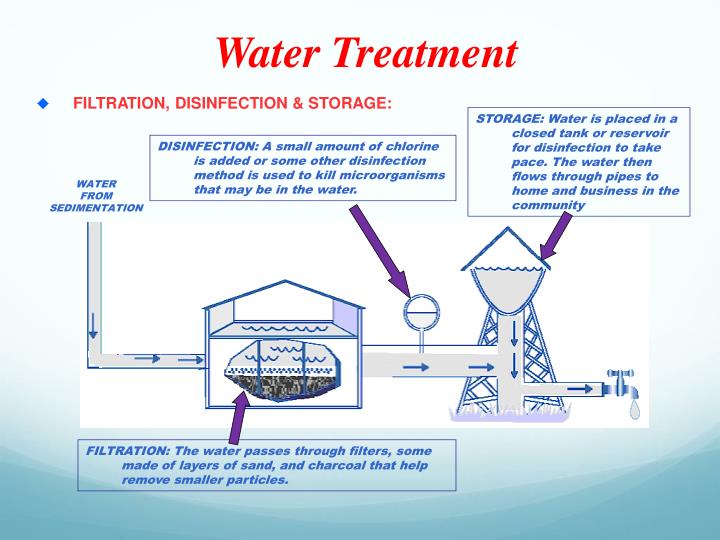
Find the location of a particular element. The image size is (720, 540). storage is located at coordinates (341, 101).